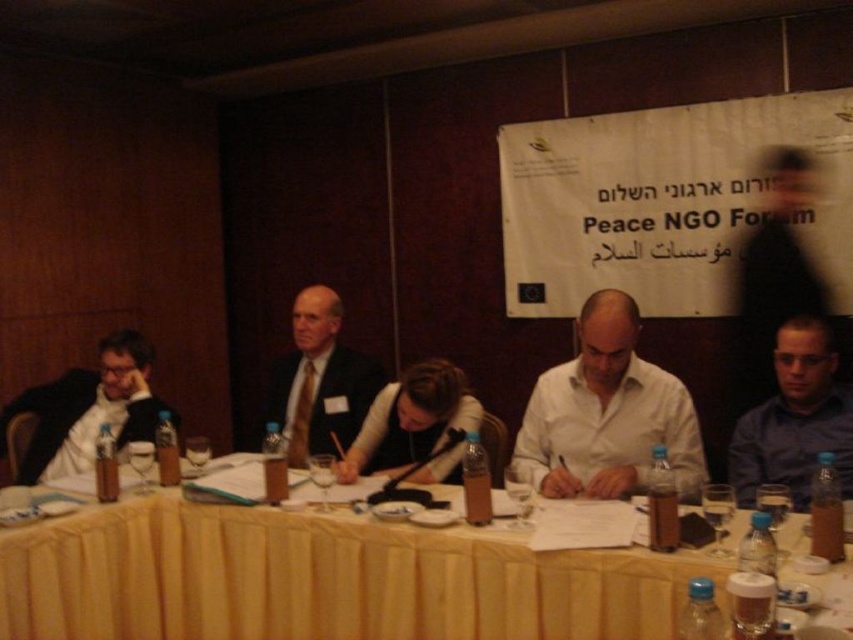
Question: Can you confirm if blue shirt at right is positioned to the right of matte black jacket at center?

Choices:
 (A) no
 (B) yes

Answer: (B)

Question: Estimate the real-world distances between objects in this image. Which object is farther from the matte black suit at center?

Choices:
 (A) yellow fabric table at center
 (B) white matte shirt at center

Answer: (B)

Question: Among these points, which one is farthest from the camera?

Choices:
 (A) (376, 362)
 (B) (595, 342)

Answer: (A)

Question: Can you confirm if white matte shirt at center is wider than matte black jacket at center?

Choices:
 (A) no
 (B) yes

Answer: (B)

Question: Can you confirm if yellow fabric table at center is bigger than blue shirt at right?

Choices:
 (A) yes
 (B) no

Answer: (A)

Question: Estimate the real-world distances between objects in this image. Which object is farther from the matte black suit at center?

Choices:
 (A) white fabric jacket at left
 (B) matte black jacket at center
 (C) yellow fabric table at center

Answer: (C)